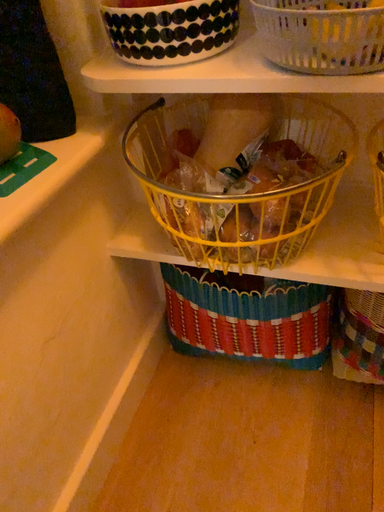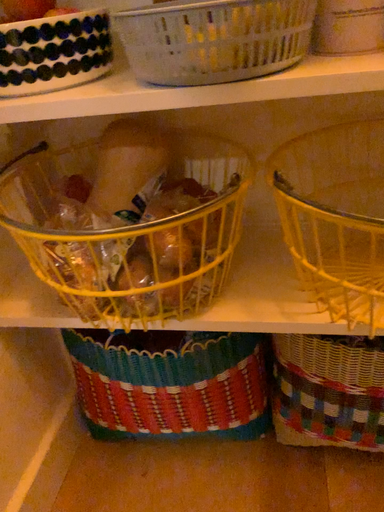
Question: How did the camera likely rotate when shooting the video?

Choices:
 (A) rotated upward
 (B) rotated downward

Answer: (A)